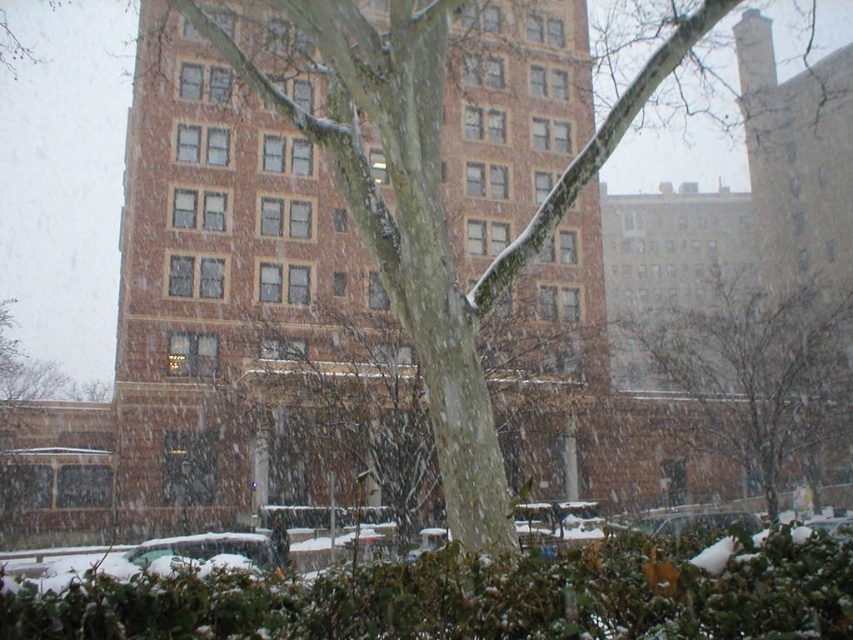
Looking at this image, you are a snowplow operator needing to clear snow from the street. You see the green leafy bush at lower center and the metallic silver car at lower left. Which object takes up more horizontal space in the image?

The metallic silver car at lower left takes up more horizontal space than the green leafy bush at lower center because the green leafy bush at lower center has a lesser width compared to metallic silver car at lower left.

You are standing in the snowy scene and want to place a small snowman between the green leafy bush at lower center and the smooth bark tree at center. Based on their positions, which object should the snowman be closer to?

The green leafy bush at lower center is above the smooth bark tree at center, so the snowman should be placed closer to the smooth bark tree at center to be between them.